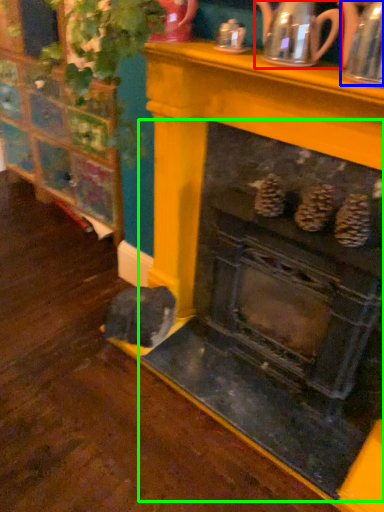
Question: Which is nearer to the tea pot (highlighted by a red box)? tea pot (highlighted by a blue box) or fireplace (highlighted by a green box).

Choices:
 (A) tea pot
 (B) fireplace

Answer: (A)